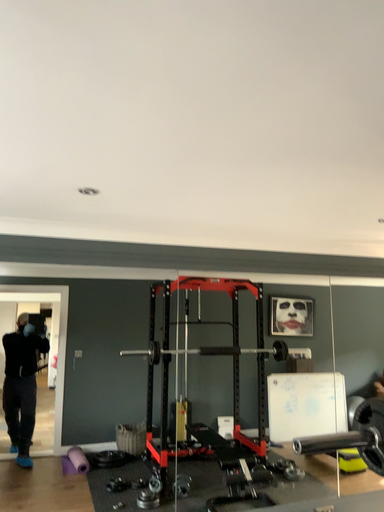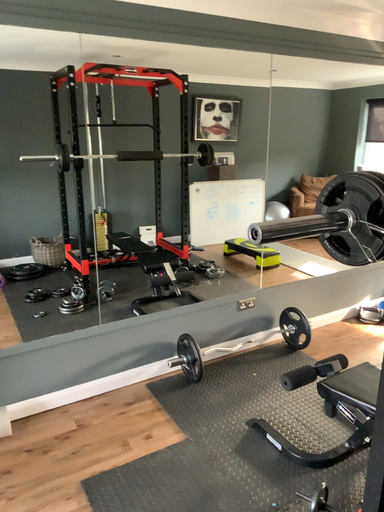
Question: Which way did the camera rotate in the video?

Choices:
 (A) rotated left
 (B) rotated right

Answer: (B)